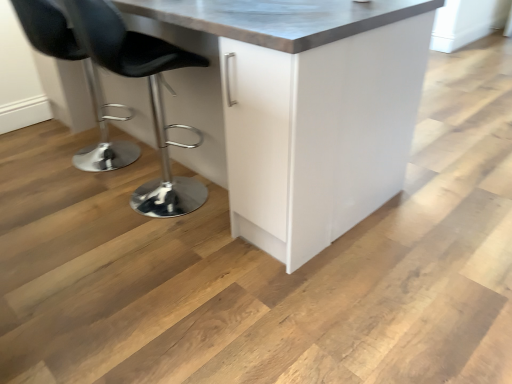
Question: Does black leather stool at left, arranged as the first chair when viewed from the right, have a larger size compared to black leather stool at left, the first chair in the left-to-right sequence?

Choices:
 (A) no
 (B) yes

Answer: (B)

Question: Considering the relative positions of black leather stool at left, arranged as the 2th chair when viewed from the left, and black leather stool at left, the second chair viewed from the right, in the image provided, is black leather stool at left, arranged as the 2th chair when viewed from the left, behind black leather stool at left, the second chair viewed from the right,?

Choices:
 (A) no
 (B) yes

Answer: (A)

Question: From the image's perspective, is black leather stool at left, arranged as the 2th chair when viewed from the left, on top of black leather stool at left, the first chair in the left-to-right sequence?

Choices:
 (A) no
 (B) yes

Answer: (A)

Question: From a real-world perspective, is black leather stool at left, arranged as the 2th chair when viewed from the left, below black leather stool at left, the first chair in the left-to-right sequence?

Choices:
 (A) no
 (B) yes

Answer: (A)

Question: Is black leather stool at left, arranged as the 2th chair when viewed from the left, positioned far away from black leather stool at left, the first chair in the left-to-right sequence?

Choices:
 (A) no
 (B) yes

Answer: (A)

Question: From their relative heights in the image, would you say black leather stool at left, the second chair viewed from the right, is taller or shorter than black leather stool at left, arranged as the first chair when viewed from the right?

Choices:
 (A) tall
 (B) short

Answer: (B)

Question: Considering the positions of black leather stool at left, the second chair viewed from the right, and black leather stool at left, arranged as the 2th chair when viewed from the left, in the image, is black leather stool at left, the second chair viewed from the right, bigger or smaller than black leather stool at left, arranged as the 2th chair when viewed from the left,?

Choices:
 (A) big
 (B) small

Answer: (B)

Question: From the image's perspective, is black leather stool at left, the first chair in the left-to-right sequence, positioned above or below black leather stool at left, arranged as the 2th chair when viewed from the left?

Choices:
 (A) above
 (B) below

Answer: (A)

Question: Do you think black leather stool at left, the second chair viewed from the right, is within black leather stool at left, arranged as the first chair when viewed from the right, or outside of it?

Choices:
 (A) inside
 (B) outside

Answer: (B)

Question: From the image's perspective, is white glossy cabinet at center positioned above or below black leather stool at left, arranged as the first chair when viewed from the right?

Choices:
 (A) below
 (B) above

Answer: (B)

Question: Considering the positions of point (240, 195) and point (196, 130), is point (240, 195) closer or farther from the camera than point (196, 130)?

Choices:
 (A) farther
 (B) closer

Answer: (B)

Question: In terms of size, does white glossy cabinet at center appear bigger or smaller than black leather stool at left, arranged as the first chair when viewed from the right?

Choices:
 (A) small
 (B) big

Answer: (B)

Question: Is white glossy cabinet at center wider or thinner than black leather stool at left, arranged as the 2th chair when viewed from the left?

Choices:
 (A) wide
 (B) thin

Answer: (A)

Question: From the image's perspective, relative to white glossy cabinet at center, is black leather stool at left, the first chair in the left-to-right sequence, above or below?

Choices:
 (A) above
 (B) below

Answer: (B)

Question: Considering the positions of black leather stool at left, the first chair in the left-to-right sequence, and white glossy cabinet at center in the image, is black leather stool at left, the first chair in the left-to-right sequence, taller or shorter than white glossy cabinet at center?

Choices:
 (A) tall
 (B) short

Answer: (B)